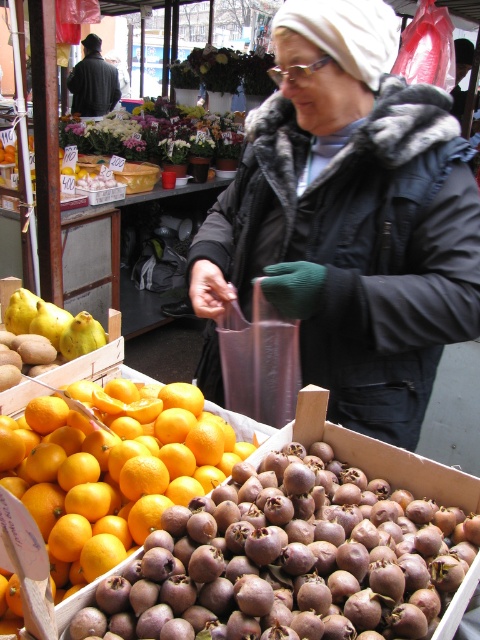
Question: Is white fur-trimmed coat at center wider than brown matte medlar at lower center?

Choices:
 (A) yes
 (B) no

Answer: (A)

Question: Which point is closer to the camera?

Choices:
 (A) white fur-trimmed coat at center
 (B) brown matte medlar at lower center

Answer: (B)

Question: Can you confirm if brown matte medlar at lower center is thinner than smooth orange at center?

Choices:
 (A) yes
 (B) no

Answer: (B)

Question: Which point is closer to the camera?

Choices:
 (A) (375, 116)
 (B) (116, 397)

Answer: (A)

Question: Which point is closer to the camera taking this photo?

Choices:
 (A) 422,556
 (B) 417,180
 (C) 49,538

Answer: (A)

Question: Is white fur-trimmed coat at center positioned before smooth orange at center?

Choices:
 (A) yes
 (B) no

Answer: (B)